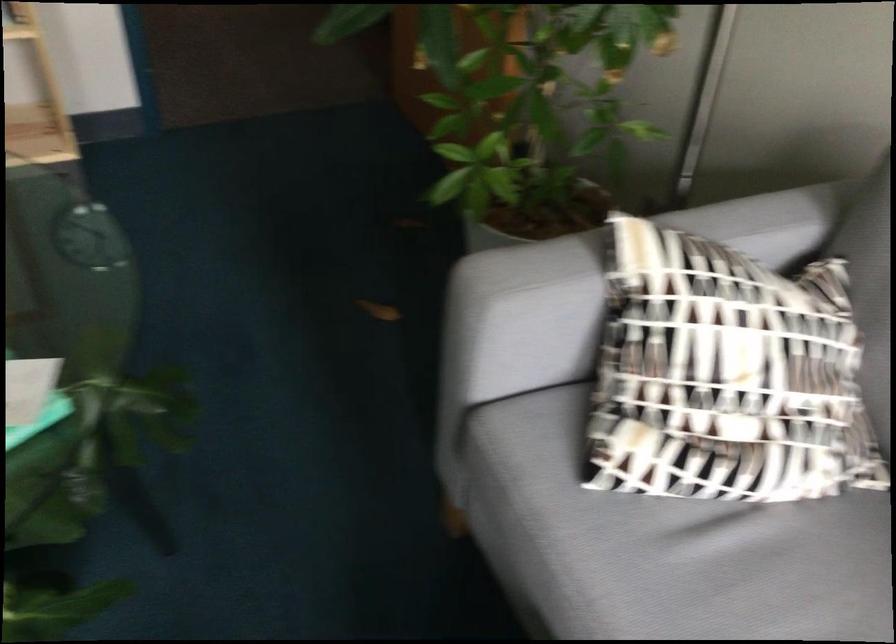
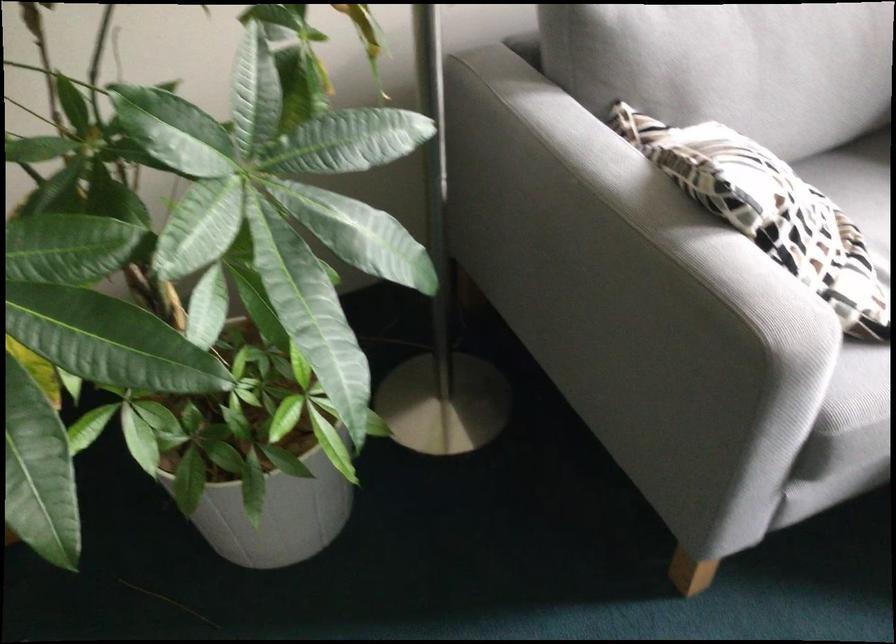
In the second image, find the point that corresponds to point 640,238 in the first image.

(604, 240)